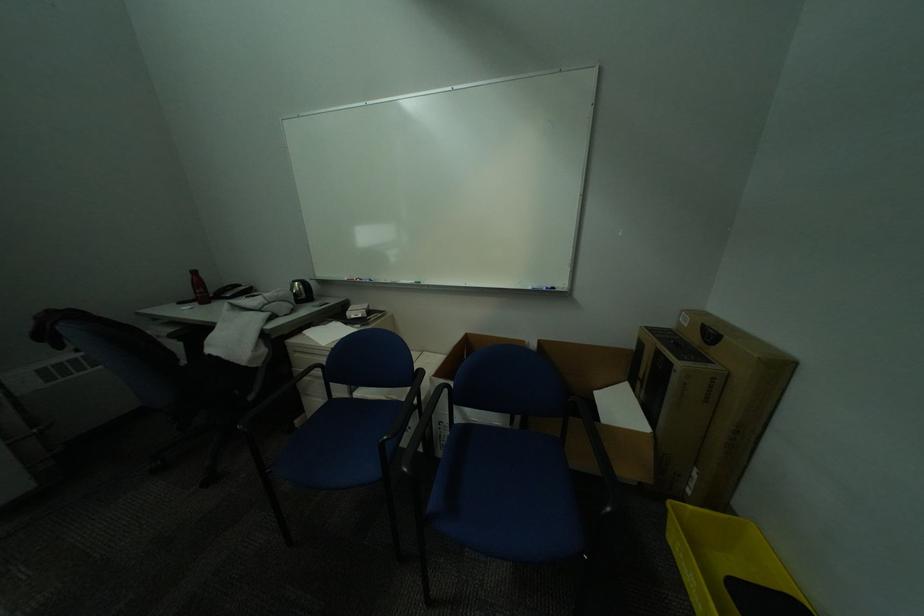
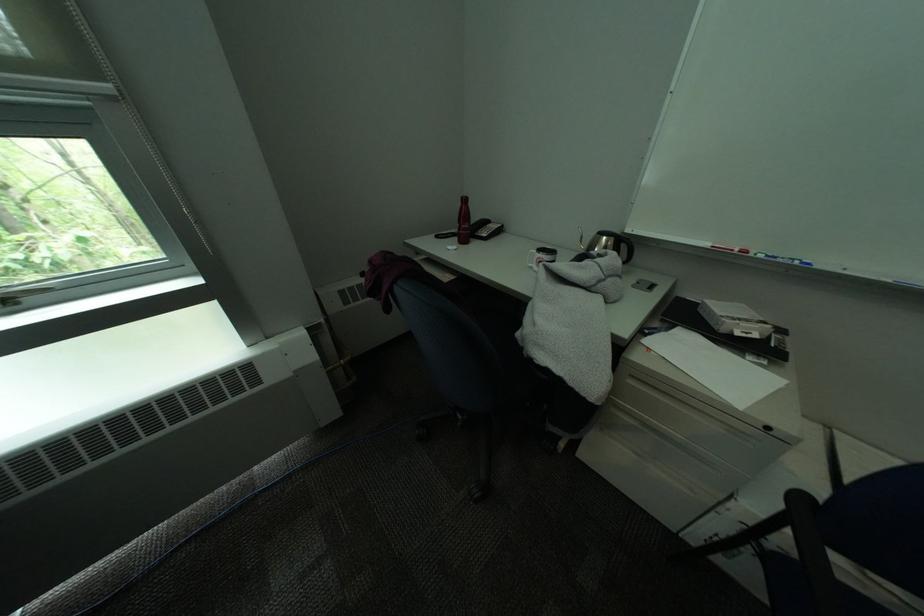
The point at (374, 282) is marked in the first image. Where is the corresponding point in the second image?

(791, 262)